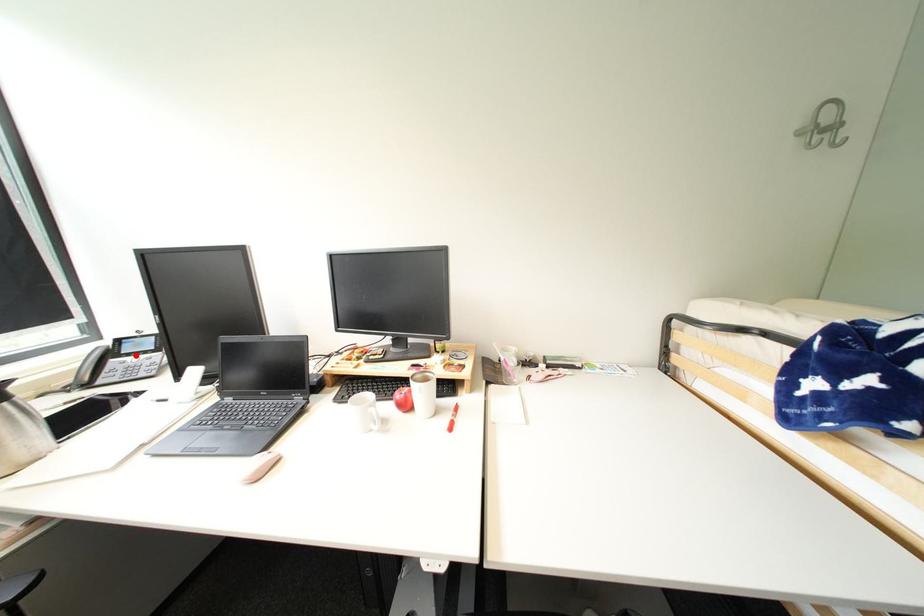
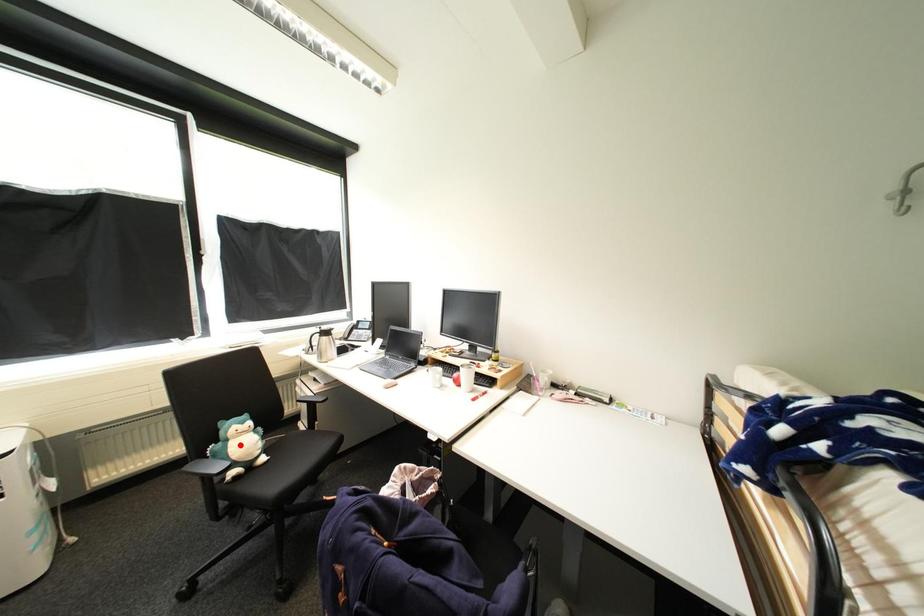
I am providing you with two images of the same scene from different viewpoints. A red point is marked on the first image and another point is marked on the second image. Is the marked point in image1 the same physical position as the marked point in image2?

No